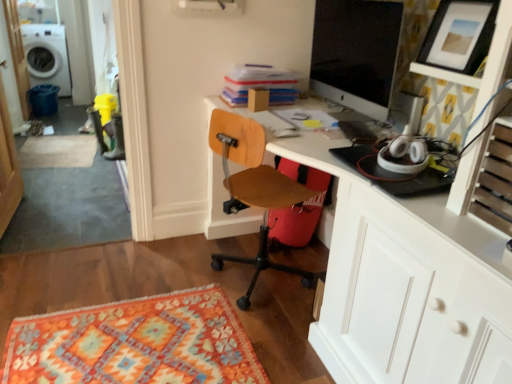
In order to click on vacant space underneath transparent glass door at left, marked as the second glass door in a top-to-bottom arrangement (from a real-world perspective) in this screenshot , I will do `click(17, 219)`.